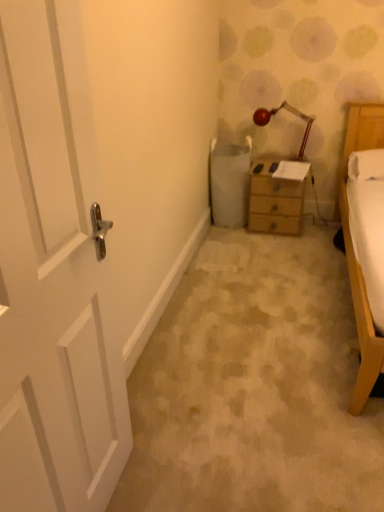
Identify the location of vacant space in front of wooden nightstand at center. This screenshot has height=512, width=384. (277, 248).